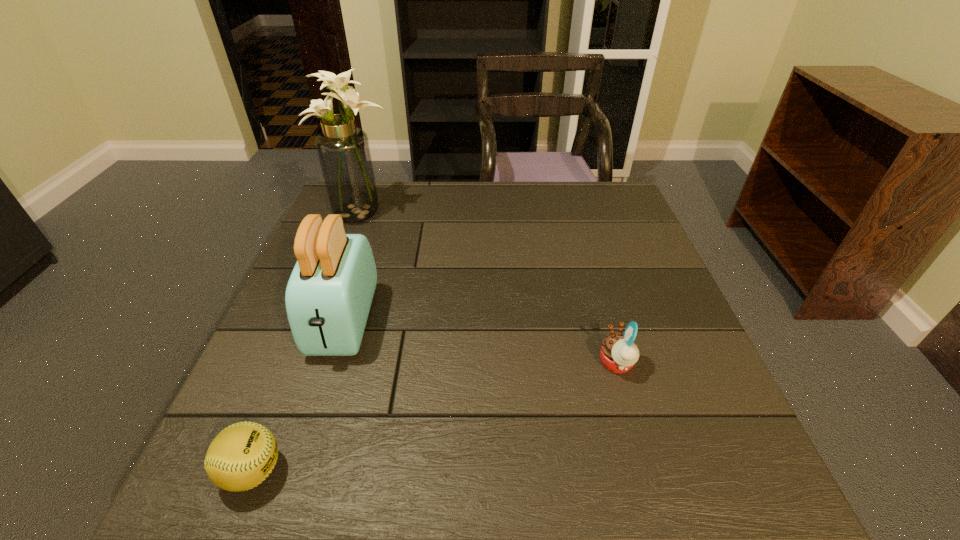
In the image, there is a desktop. Where is `free region at the near edge`? This screenshot has height=540, width=960. free region at the near edge is located at coordinates (324, 489).

In the image, there is a desktop. Identify the location of free space at the left edge. The width and height of the screenshot is (960, 540). (327, 370).

The height and width of the screenshot is (540, 960). Identify the location of free space at the right edge of the desktop. (653, 308).

Find the location of a particular element. This screenshot has height=540, width=960. vacant point at the far left corner is located at coordinates click(x=372, y=220).

You are a GUI agent. You are given a task and a screenshot of the screen. Output one action in this format:
    pyautogui.click(x=<x>, y=<y>)
    Task: Click on the vacant space at the near right corner of the desktop
    The image size is (960, 540).
    Given the screenshot: What is the action you would take?
    pyautogui.click(x=710, y=481)

You are a GUI agent. You are given a task and a screenshot of the screen. Output one action in this format:
    pyautogui.click(x=<x>, y=<y>)
    Task: Click on the free spot between the nearest object and the rightmost object
    
    Given the screenshot: What is the action you would take?
    pyautogui.click(x=435, y=417)

Locate an element on the screen. free spot between the muffin and the softball is located at coordinates (435, 417).

Locate an element on the screen. The width and height of the screenshot is (960, 540). vacant space that is in between the third shortest object and the rightmost object is located at coordinates (480, 343).

In order to click on empty location between the muffin and the toaster in this screenshot , I will do `click(480, 343)`.

Locate an element on the screen. Image resolution: width=960 pixels, height=540 pixels. vacant area between the third shortest object and the nearest object is located at coordinates (299, 396).